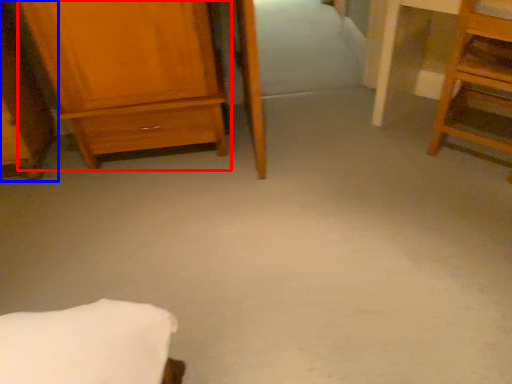
Question: Which object appears farthest to the camera in this image, chest of drawers (highlighted by a red box) or furniture (highlighted by a blue box)?

Choices:
 (A) chest of drawers
 (B) furniture

Answer: (A)